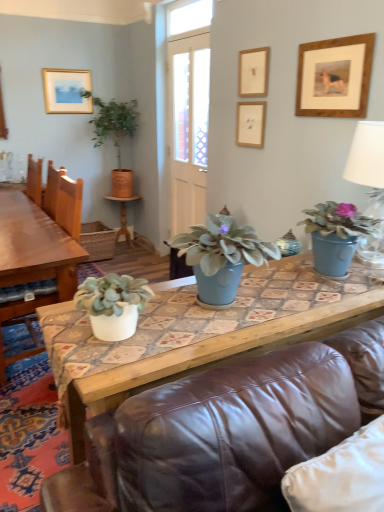
Question: Could you tell me if matte blue pot at center, the 2th houseplant viewed from the right, is facing white ceramic lamp at upper right?

Choices:
 (A) no
 (B) yes

Answer: (A)

Question: Can you confirm if matte blue pot at center, the 2th houseplant viewed from the right, is wider than white ceramic lamp at upper right?

Choices:
 (A) yes
 (B) no

Answer: (B)

Question: Is matte blue pot at center, the 2th houseplant viewed from the right, thinner than white ceramic lamp at upper right?

Choices:
 (A) no
 (B) yes

Answer: (B)

Question: Is matte blue pot at center, marked as the second houseplant in a bottom-to-top arrangement, at the left side of white ceramic lamp at upper right?

Choices:
 (A) no
 (B) yes

Answer: (B)

Question: Is matte blue pot at center, the 3th houseplant positioned from the top, further to the viewer compared to white ceramic lamp at upper right?

Choices:
 (A) yes
 (B) no

Answer: (B)

Question: Would you say matte gold picture frame at upper left, the 1th picture frame viewed from the left, is inside or outside wooden picture frame at upper center, which ranks as the third picture frame in front-to-back order?

Choices:
 (A) inside
 (B) outside

Answer: (B)

Question: In terms of size, does matte gold picture frame at upper left, arranged as the fourth picture frame when viewed from the front, appear bigger or smaller than wooden picture frame at upper center, which ranks as the third picture frame in front-to-back order?

Choices:
 (A) small
 (B) big

Answer: (B)

Question: Is matte gold picture frame at upper left, arranged as the fourth picture frame when viewed from the front, in front of or behind wooden picture frame at upper center, marked as the third picture frame in a left-to-right arrangement, in the image?

Choices:
 (A) behind
 (B) front

Answer: (A)

Question: Would you say matte gold picture frame at upper left, positioned as the first picture frame in back-to-front order, is to the left or to the right of wooden picture frame at upper center, which ranks as the third picture frame in front-to-back order, in the picture?

Choices:
 (A) left
 (B) right

Answer: (A)

Question: Is point (251, 75) closer or farther from the camera than point (79, 78)?

Choices:
 (A) closer
 (B) farther

Answer: (A)

Question: Considering the positions of wooden picture frame at upper center, which is the 3th picture frame in back-to-front order, and matte gold picture frame at upper left, the 4th picture frame from the right, in the image, is wooden picture frame at upper center, which is the 3th picture frame in back-to-front order, taller or shorter than matte gold picture frame at upper left, the 4th picture frame from the right,?

Choices:
 (A) short
 (B) tall

Answer: (A)

Question: Considering the positions of wooden picture frame at upper center, marked as the 2th picture frame in a left-to-right arrangement, and matte gold picture frame at upper left, the 1th picture frame viewed from the left, in the image, is wooden picture frame at upper center, marked as the 2th picture frame in a left-to-right arrangement, bigger or smaller than matte gold picture frame at upper left, the 1th picture frame viewed from the left,?

Choices:
 (A) big
 (B) small

Answer: (B)

Question: From a real-world perspective, is wooden picture frame at upper center, marked as the 2th picture frame in a left-to-right arrangement, positioned above or below matte gold picture frame at upper left, arranged as the fourth picture frame when viewed from the front?

Choices:
 (A) below
 (B) above

Answer: (B)

Question: In terms of size, does matte blue pot at center, marked as the second houseplant in a bottom-to-top arrangement, appear bigger or smaller than matte blue vase at center, placed as the first coffee table when sorted from front to back?

Choices:
 (A) small
 (B) big

Answer: (A)

Question: Looking at their shapes, would you say matte blue pot at center, which is counted as the third houseplant, starting from the back, is wider or thinner than matte blue vase at center, placed as the first coffee table when sorted from front to back?

Choices:
 (A) thin
 (B) wide

Answer: (A)